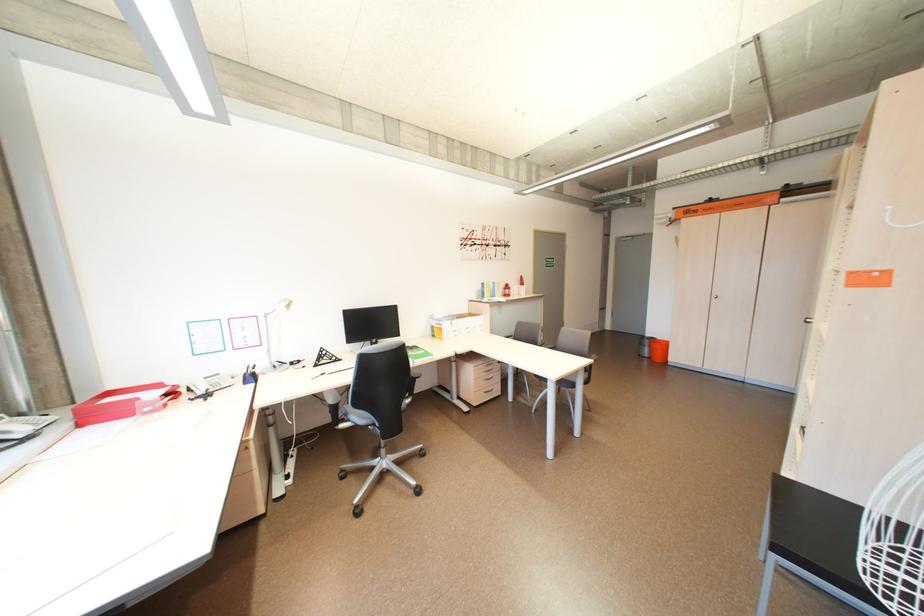
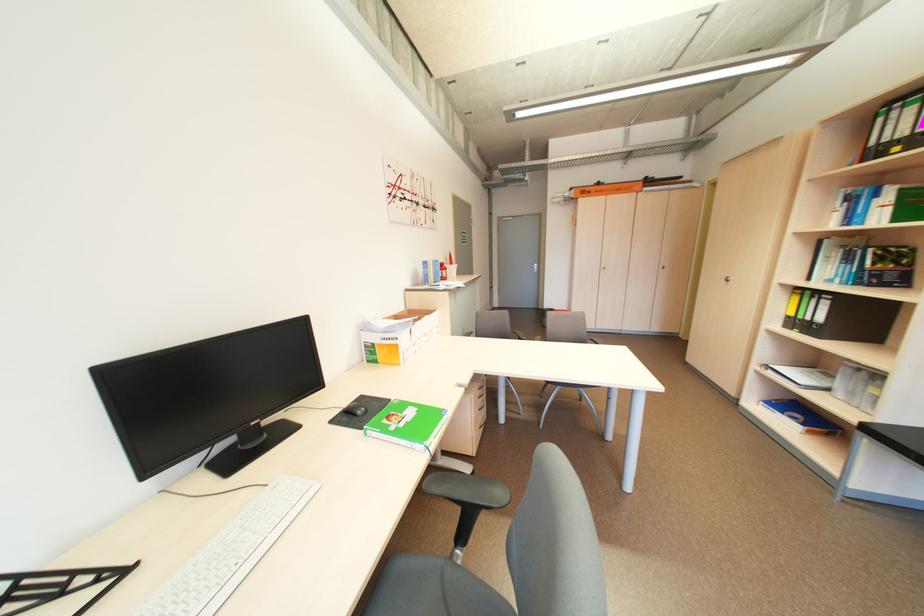
Locate, in the second image, the point that corresponds to pixel 343 359 in the first image.

(91, 582)